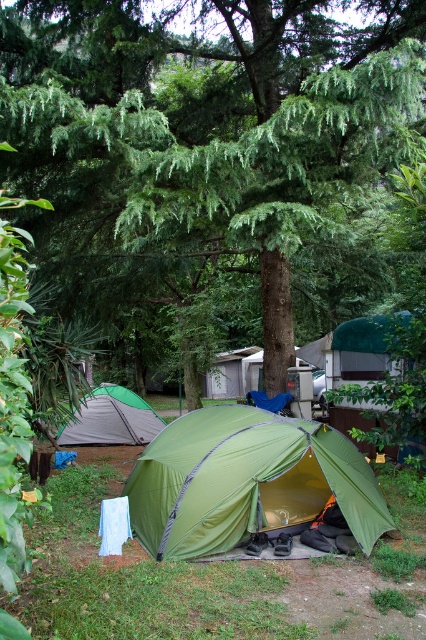
You are setting up a tent in the camping area shown. You have a green fabric tent at lower left and a green leafy tree at center. Can the tree fit horizontally between the tent and the edge of the camping area if the tent is placed as shown?

The green leafy tree at center is narrower than the green fabric tent at lower left. Since the tree is narrower, it can fit horizontally between the tent and the edge of the camping area if the tent is placed as shown.

You are planning to set up a tent in your backyard and have two options. The first is the green fabric tent at center, and the second is the green fabric tent at lower left. Which tent would provide more space for sleeping inside?

The green fabric tent at center has a larger width than the green fabric tent at lower left, so it would provide more space for sleeping inside.